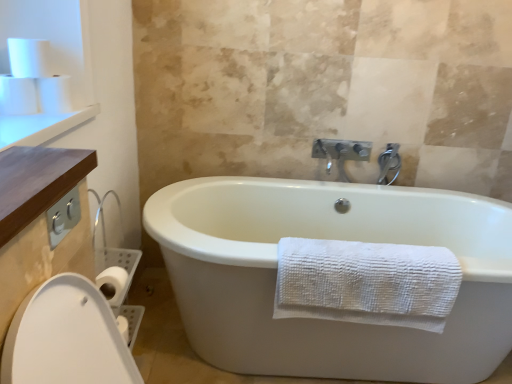
Question: Does white matte toilet paper at upper left, which appears as the first toilet paper when viewed from the left, have a greater height compared to white matte toilet paper at upper left, which is counted as the third toilet paper, starting from the left?

Choices:
 (A) no
 (B) yes

Answer: (A)

Question: From the image's perspective, is white matte toilet paper at upper left, which appears as the first toilet paper when viewed from the left, on top of white matte toilet paper at upper left, which is counted as the third toilet paper, starting from the left?

Choices:
 (A) yes
 (B) no

Answer: (B)

Question: Can you confirm if white matte toilet paper at upper left, placed as the third toilet paper when sorted from right to left, is positioned to the left of white matte toilet paper at upper left, which is counted as the third toilet paper, starting from the left?

Choices:
 (A) yes
 (B) no

Answer: (A)

Question: From a real-world perspective, does white matte toilet paper at upper left, placed as the third toilet paper when sorted from right to left, stand above white matte toilet paper at upper left, which is counted as the third toilet paper, starting from the left?

Choices:
 (A) no
 (B) yes

Answer: (B)

Question: Is white matte toilet paper at upper left, which appears as the first toilet paper when viewed from the left, shorter than white matte toilet paper at upper left, which is the 1th toilet paper from right to left?

Choices:
 (A) yes
 (B) no

Answer: (A)

Question: Is wooden counter at upper left, arranged as the 1th counter top when viewed from the top, spatially inside silver metallic faucet at upper center, or outside of it?

Choices:
 (A) inside
 (B) outside

Answer: (B)

Question: From the image's perspective, is wooden counter at upper left, the 1th counter top when ordered from back to front, positioned above or below silver metallic faucet at upper center?

Choices:
 (A) above
 (B) below

Answer: (A)

Question: Does point (10, 145) appear closer or farther from the camera than point (392, 167)?

Choices:
 (A) farther
 (B) closer

Answer: (B)

Question: In the image, is wooden counter at upper left, the 1th counter top when ordered from back to front, on the left side or the right side of silver metallic faucet at upper center?

Choices:
 (A) left
 (B) right

Answer: (A)

Question: Considering the positions of white textured towel at lower center and brown wood counter at upper left, marked as the 1th counter top in a right-to-left arrangement, in the image, is white textured towel at lower center wider or thinner than brown wood counter at upper left, marked as the 1th counter top in a right-to-left arrangement,?

Choices:
 (A) thin
 (B) wide

Answer: (A)

Question: From a real-world perspective, is white textured towel at lower center physically located above or below brown wood counter at upper left, the first counter top viewed from the front?

Choices:
 (A) below
 (B) above

Answer: (A)

Question: From their relative heights in the image, would you say white textured towel at lower center is taller or shorter than brown wood counter at upper left, the first counter top viewed from the front?

Choices:
 (A) tall
 (B) short

Answer: (A)

Question: In terms of size, does white textured towel at lower center appear bigger or smaller than brown wood counter at upper left, the second counter top positioned from the top?

Choices:
 (A) big
 (B) small

Answer: (A)

Question: Is brown wood counter at upper left, acting as the second counter top starting from the left, wider or thinner than white matte toilet paper at upper left, which appears as the first toilet paper when viewed from the left?

Choices:
 (A) thin
 (B) wide

Answer: (B)

Question: In terms of size, does brown wood counter at upper left, the second counter top positioned from the top, appear bigger or smaller than white matte toilet paper at upper left, which appears as the first toilet paper when viewed from the left?

Choices:
 (A) big
 (B) small

Answer: (A)